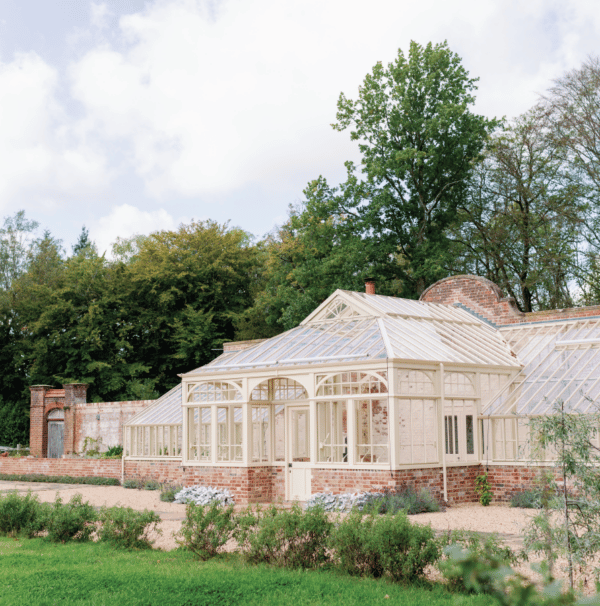
Find the location of a particular element. The image size is (600, 606). decrative brick arch on roof is located at coordinates (460, 291).